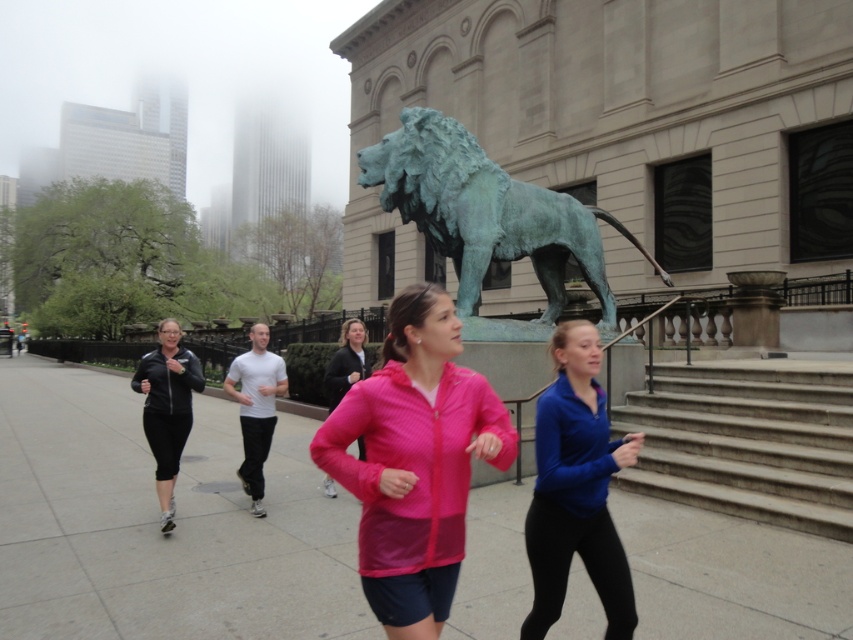
Is black leather jacket at left above pink zip-up jacket at center?

Incorrect, black leather jacket at left is not positioned above pink zip-up jacket at center.

Who is more distant from viewer, [167,339] or [347,371]?

Positioned behind is point [347,371].

This screenshot has height=640, width=853. Find the location of `black leather jacket at left`. black leather jacket at left is located at coordinates (167, 406).

Is blue matte jacket at center above black leather jacket at left?

Indeed, blue matte jacket at center is positioned over black leather jacket at left.

Is blue matte jacket at center bigger than black leather jacket at left?

Incorrect, blue matte jacket at center is not larger than black leather jacket at left.

This screenshot has height=640, width=853. I want to click on blue matte jacket at center, so click(576, 488).

Locate an element on the screen. The image size is (853, 640). blue matte jacket at center is located at coordinates (576, 488).

Between green patina lion at center and blue matte jacket at center, which one has less height?

With less height is blue matte jacket at center.

Can you confirm if green patina lion at center is taller than blue matte jacket at center?

Correct, green patina lion at center is much taller as blue matte jacket at center.

At what (x,y) coordinates should I click in order to perform the action: click on green patina lion at center. Please return your answer as a coordinate pair (x, y). This screenshot has width=853, height=640. Looking at the image, I should click on (486, 212).